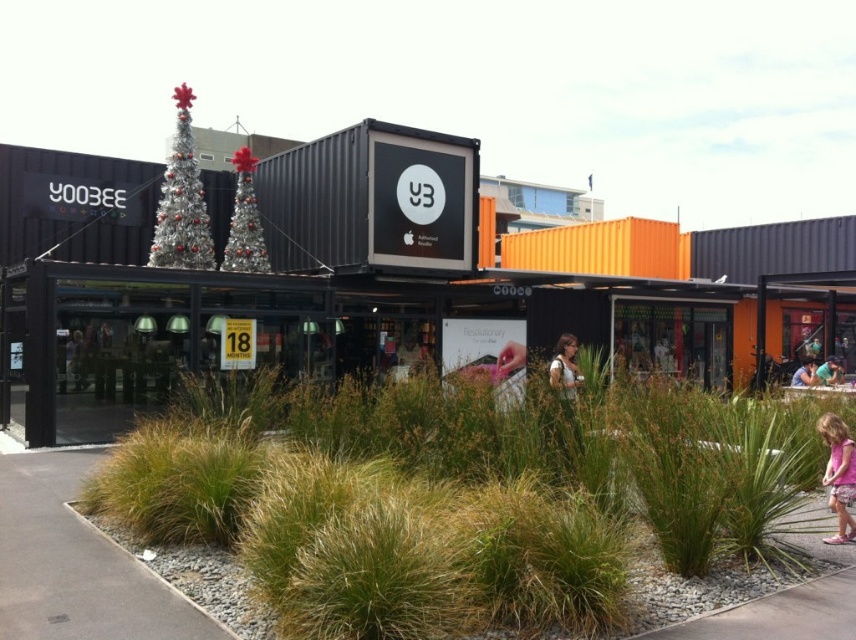
You are standing at the entrance of the retail space and want to locate the black matte shipping container at center. According to the coordinates given, where should you look relative to your position?

The black matte shipping container at center is located at coordinates point (411, 294), which would be slightly to the right and a bit below your central line of sight.

You are a customer standing in the retail space and want to place a small potted plant between the green grass at center and the pink fabric dress at lower right. Based on their sizes, which object should the plant be closer to?

The green grass at center is larger than the pink fabric dress at lower right, so the plant should be placed closer to the pink fabric dress at lower right to balance the sizes.